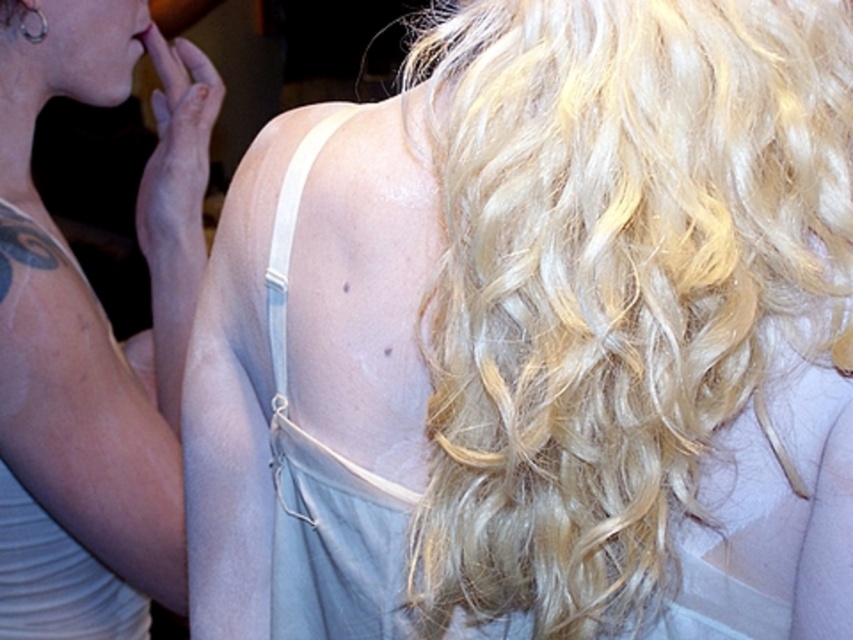
I want to click on blonde hair at upper right, so [x=97, y=300].

Identify the location of blonde hair at upper right. This screenshot has height=640, width=853. pos(97,300).

Is blonde hair at upper right below silver metallic ring at upper left?

Yes.

Does blonde hair at upper right have a smaller size compared to silver metallic ring at upper left?

Actually, blonde hair at upper right might be larger than silver metallic ring at upper left.

The height and width of the screenshot is (640, 853). I want to click on blonde hair at upper right, so click(x=97, y=300).

Does point (28, 8) come in front of point (138, 35)?

Yes, point (28, 8) is closer to viewer.

Can you confirm if silver metallic ring at upper left is wider than matte pink lipstick at upper left?

No, silver metallic ring at upper left is not wider than matte pink lipstick at upper left.

Where is `silver metallic ring at upper left`? silver metallic ring at upper left is located at coordinates (39, 26).